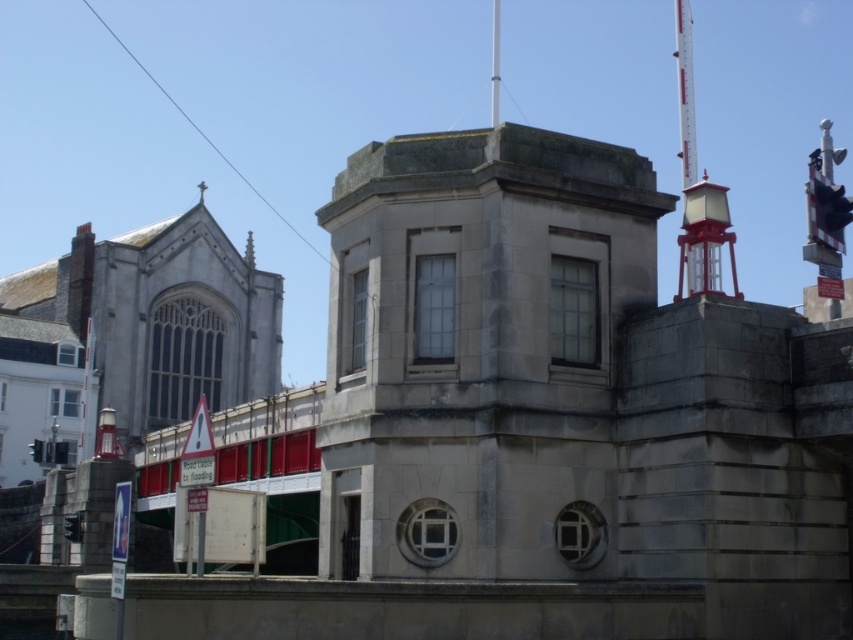
Is point (610, 198) positioned in front of point (682, 157)?

Yes.

Which is in front, point (569, 499) or point (679, 291)?

Point (569, 499)

Who is more forward, (422, 570) or (674, 17)?

Point (422, 570) is more forward.

The image size is (853, 640). What are the coordinates of `gray stone tower at center` in the screenshot? It's located at pyautogui.click(x=479, y=353).

Who is positioned more to the left, gray stone tower at center or metallic pole at upper center?

gray stone tower at center is more to the left.

Which of these two, gray stone tower at center or metallic pole at upper center, stands taller?

metallic pole at upper center

You are a GUI agent. You are given a task and a screenshot of the screen. Output one action in this format:
    pyautogui.click(x=<x>, y=<y>)
    Task: Click on the gray stone tower at center
    The height and width of the screenshot is (640, 853).
    Given the screenshot: What is the action you would take?
    pyautogui.click(x=479, y=353)

Between red painted metal mast at upper right and metallic pole at upper center, which one is positioned higher?

Positioned higher is metallic pole at upper center.

Does red painted metal mast at upper right appear on the left side of metallic pole at upper center?

No, red painted metal mast at upper right is not to the left of metallic pole at upper center.

Does point (689, 36) come behind point (491, 77)?

Yes, point (689, 36) is behind point (491, 77).

The image size is (853, 640). Find the location of `red painted metal mast at upper right`. red painted metal mast at upper right is located at coordinates (685, 92).